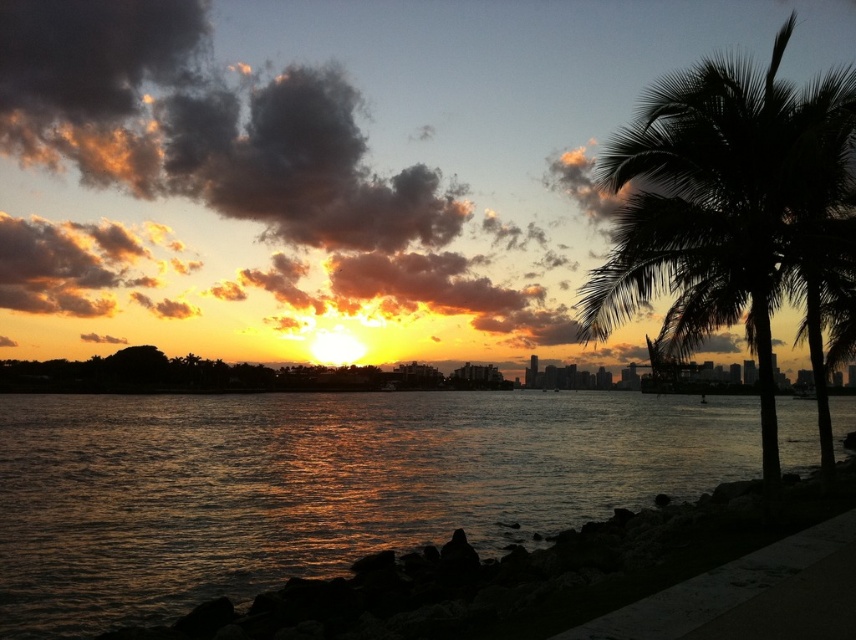
You are standing on the rocky shoreline and want to take a photo of the sunset. Which object in the scene, the glistening water at lower left or the silhouette leafy palm at right, is positioned lower from your viewpoint?

The glistening water at lower left is positioned lower than the silhouette leafy palm at right from your viewpoint.

From the picture: You are standing at the center of the image and want to take a photo of the glistening water at lower left. In which direction should you move to get a better view of it?

You should move towards the lower left direction to get a better view of the glistening water at lower left since it is located at point (x=314, y=483).